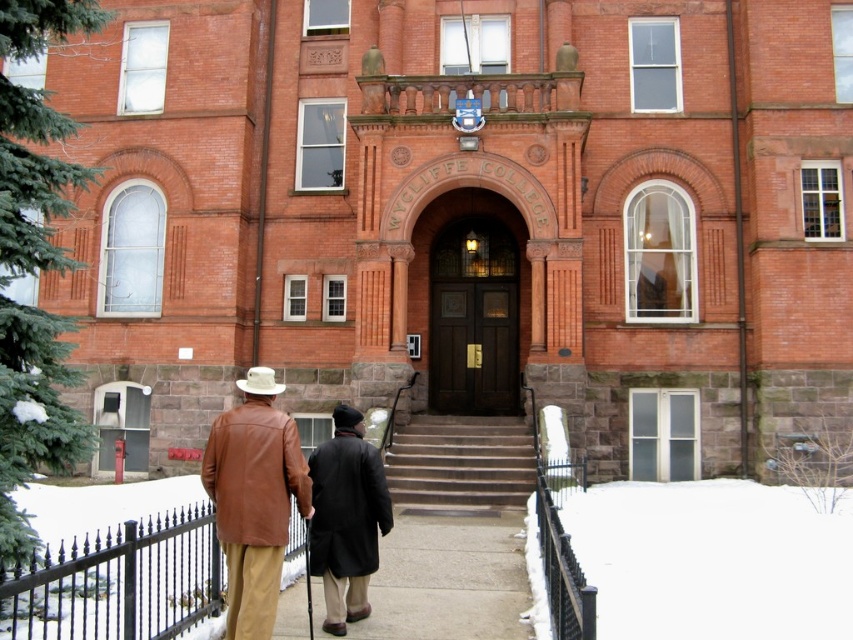
Question: Is white powdery snow at lower center wider than brown leather coat at center?

Choices:
 (A) no
 (B) yes

Answer: (B)

Question: Is brown leather coat at center bigger than smooth stone stairs at center?

Choices:
 (A) no
 (B) yes

Answer: (B)

Question: Is white powdery snow at lower center behind dark brown leather coat at center?

Choices:
 (A) yes
 (B) no

Answer: (B)

Question: Which of these objects is positioned closest to the white powdery snow at lower center?

Choices:
 (A) dark brown leather coat at center
 (B) smooth stone stairs at center

Answer: (B)

Question: Which object is the farthest from the dark brown leather coat at center?

Choices:
 (A) smooth stone stairs at center
 (B) brown leather coat at center
 (C) white powdery snow at lower center

Answer: (A)

Question: Which object is closer to the camera taking this photo?

Choices:
 (A) dark brown leather coat at center
 (B) brown leather coat at center
 (C) white powdery snow at lower center

Answer: (C)